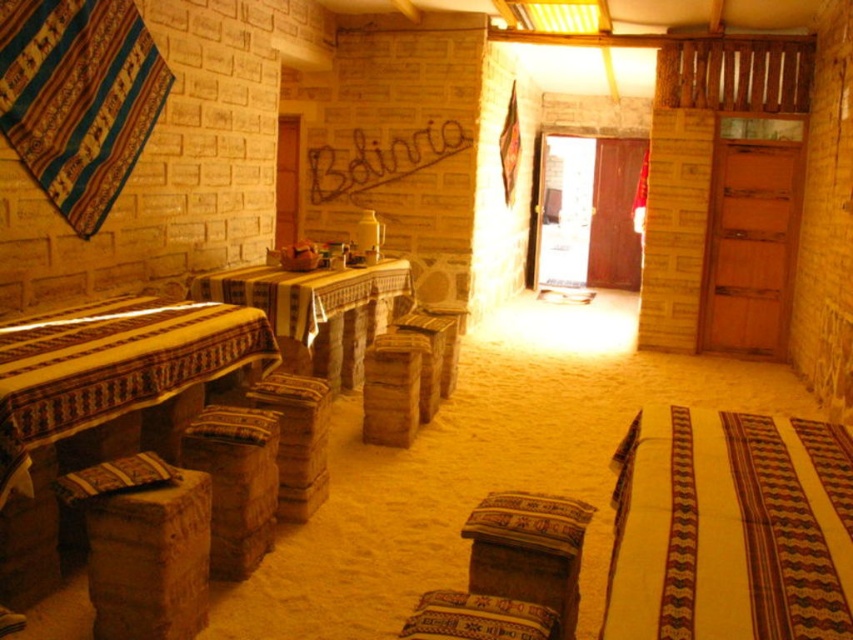
Can you confirm if striped cotton blanket at lower right is positioned above rustic wood stool at lower left?

Indeed, striped cotton blanket at lower right is positioned over rustic wood stool at lower left.

What do you see at coordinates (730, 528) in the screenshot?
I see `striped cotton blanket at lower right` at bounding box center [730, 528].

Who is more distant from viewer, (750,440) or (158,611)?

The point (750,440) is more distant.

Find the location of a particular element. This screenshot has width=853, height=640. striped cotton blanket at lower right is located at coordinates (730, 528).

From the picture: Between textured woven stool at lower center and patterned fabric pillow at lower left, which one has less height?

patterned fabric pillow at lower left is shorter.

Who is higher up, textured woven stool at lower center or patterned fabric pillow at lower left?

patterned fabric pillow at lower left is higher up.

Is point (576, 563) farther from camera compared to point (83, 490)?

Yes, point (576, 563) is behind point (83, 490).

Locate an element on the screen. textured woven stool at lower center is located at coordinates pos(527,550).

Is striped cotton blanket at lower right to the right of wooden stool at center from the viewer's perspective?

Yes, striped cotton blanket at lower right is to the right of wooden stool at center.

Does point (663, 483) lie behind point (415, 336)?

No.

Between point (834, 540) and point (367, 410), which one is positioned in front?

Point (834, 540) is more forward.

Identify the location of striped cotton blanket at lower right. The image size is (853, 640). (730, 528).